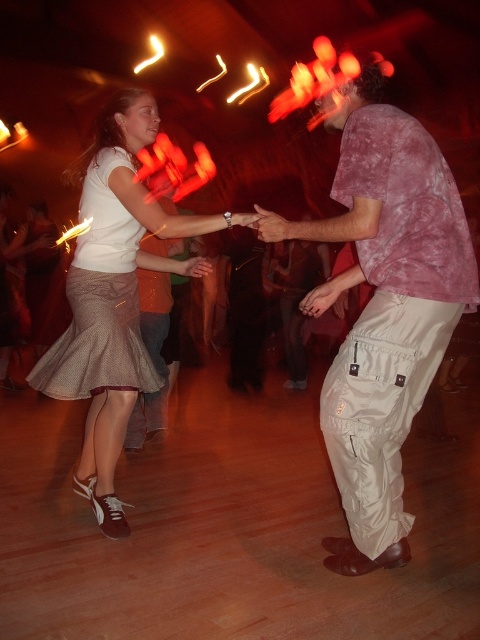
Question: Which object is closer to the camera taking this photo?

Choices:
 (A) white cotton skirt at center
 (B) brown textured skirt at center

Answer: (A)

Question: Considering the real-world distances, which object is farthest from the maroon tie-dye shirt at right?

Choices:
 (A) white cotton skirt at center
 (B) brown textured skirt at center

Answer: (B)

Question: Estimate the real-world distances between objects in this image. Which object is closer to the maroon tie-dye shirt at right?

Choices:
 (A) white cotton skirt at center
 (B) brown textured skirt at center

Answer: (A)

Question: Can you confirm if maroon tie-dye shirt at right is positioned to the left of brown textured skirt at center?

Choices:
 (A) no
 (B) yes

Answer: (A)

Question: Where is maroon tie-dye shirt at right located in relation to brown textured skirt at center in the image?

Choices:
 (A) right
 (B) left

Answer: (A)

Question: Does maroon tie-dye shirt at right appear on the right side of white cotton skirt at center?

Choices:
 (A) yes
 (B) no

Answer: (A)